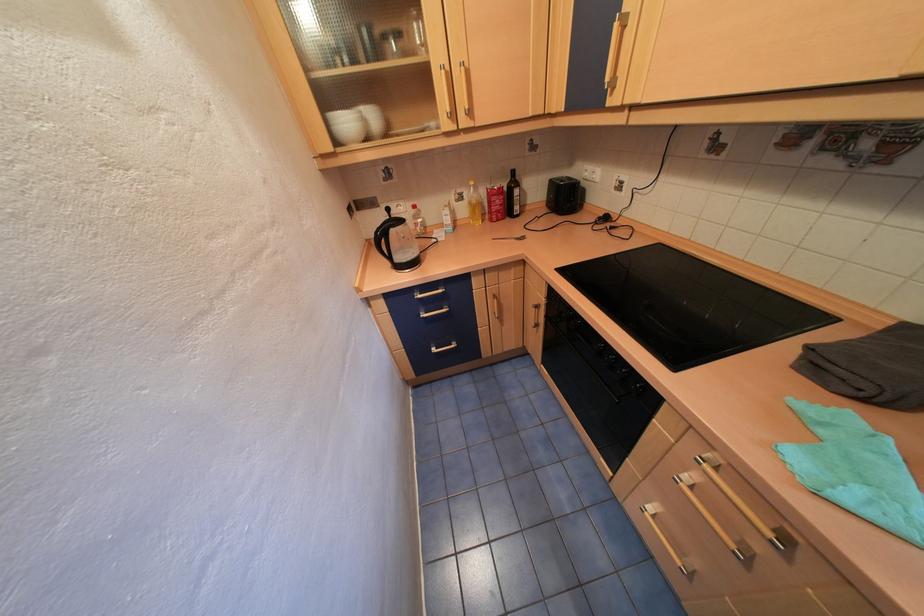
The location [509,238] corresponds to which object?

It refers to a small metal spoon.